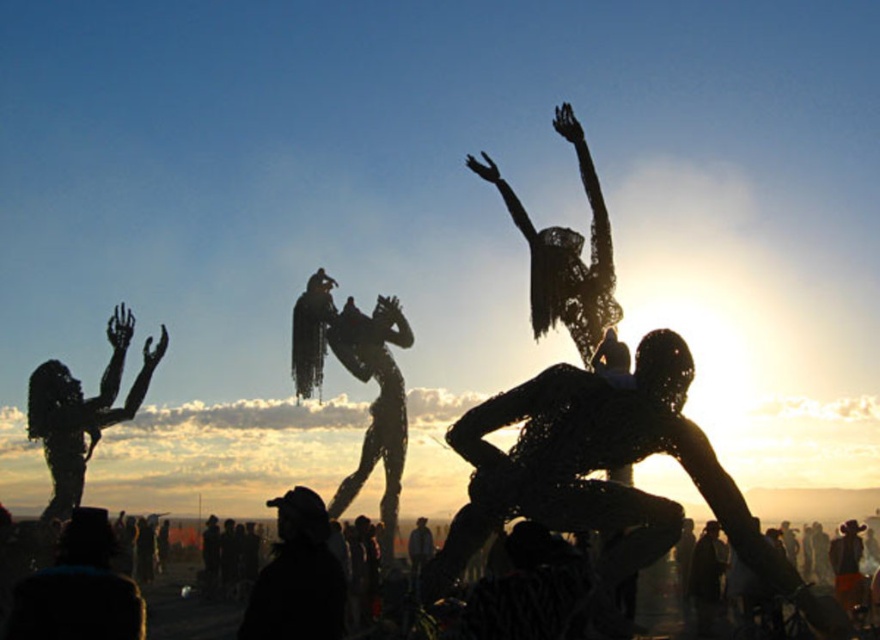
You are a photographer standing at the camera position. You want to take a closeup shot of the silvery wire sculpture at left. Considering its distance, can you use a standard 50mm lens, or do you need a telephoto lens?

The silvery wire sculpture at left is 185.05 meters from camera. A standard 50mm lens may not provide sufficient magnification to capture a closeup from that distance. You would need a telephoto lens to achieve the desired closeup shot.

You are an artist trying to place a new sculpture between the metallic wire sculpture at center and the black fabric hat at lower center. Based on their sizes, which one should you consider for spacing adjustments?

The metallic wire sculpture at center is wider than the black fabric hat at lower center, so you should consider adjusting the spacing around the metallic wire sculpture at center to accommodate its larger size.

You are a photographer at the festival and want to capture both the metallic wire sculpture at center and the black fabric hat at lower center in a single frame. Which object should you position closer to the left side of your camera viewfinder to ensure both are included?

To include both the metallic wire sculpture at center and the black fabric hat at lower center in your frame, position the black fabric hat at lower center closer to the left side of your camera viewfinder since the metallic wire sculpture at center is already to the right of it.